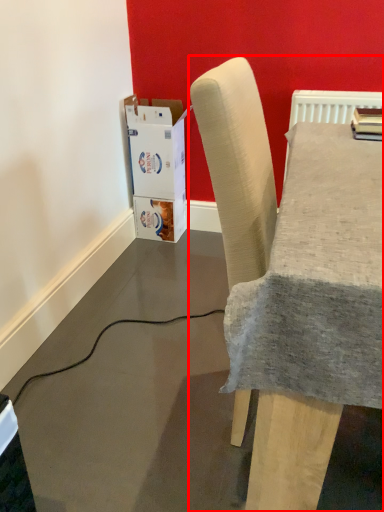
Question: From the image's perspective, where is chair (annotated by the red box) located in relation to cardboard box in the image?

Choices:
 (A) above
 (B) below

Answer: (B)